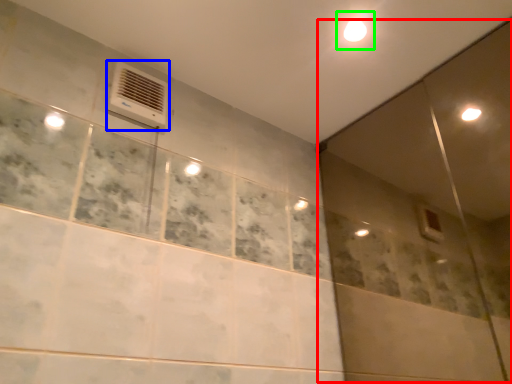
Question: Estimate the real-world distances between objects in this image. Which object is closer to screen door (highlighted by a red box), air conditioning (highlighted by a blue box) or light (highlighted by a green box)?

Choices:
 (A) air conditioning
 (B) light

Answer: (B)